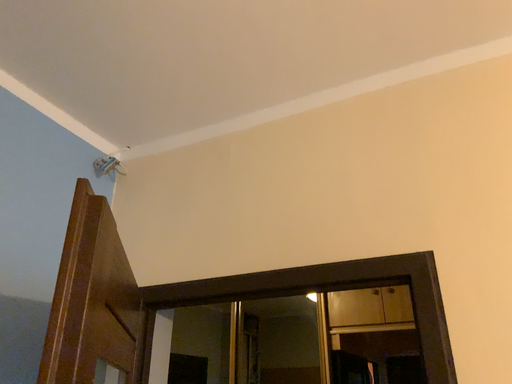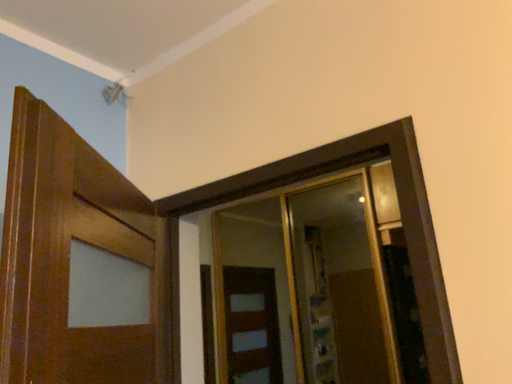
Question: Which way did the camera rotate in the video?

Choices:
 (A) rotated left
 (B) rotated right

Answer: (A)